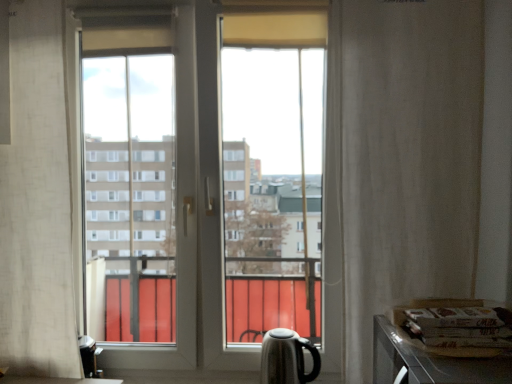
Question: Is white textured curtain at right, the 2th curtain positioned from the left, at the back of transparent glass window at center?

Choices:
 (A) yes
 (B) no

Answer: (B)

Question: Considering the relative sizes of transparent glass window at center and white textured curtain at right, the 2th curtain positioned from the left, in the image provided, is transparent glass window at center thinner than white textured curtain at right, the 2th curtain positioned from the left,?

Choices:
 (A) yes
 (B) no

Answer: (B)

Question: Can you confirm if transparent glass window at center is positioned to the left of white textured curtain at right, the 2th curtain positioned from the left?

Choices:
 (A) no
 (B) yes

Answer: (B)

Question: Considering the relative sizes of transparent glass window at center and white textured curtain at right, the 2th curtain positioned from the left, in the image provided, is transparent glass window at center shorter than white textured curtain at right, the 2th curtain positioned from the left,?

Choices:
 (A) yes
 (B) no

Answer: (B)

Question: Is the depth of transparent glass window at center less than that of white textured curtain at right, which is the first curtain from right to left?

Choices:
 (A) yes
 (B) no

Answer: (B)

Question: From the image's perspective, is transparent glass window at center on top of white textured curtain at right, which is the first curtain from right to left?

Choices:
 (A) no
 (B) yes

Answer: (A)

Question: Does transparent glass window at center appear on the right side of black glossy kettle at lower right?

Choices:
 (A) yes
 (B) no

Answer: (B)

Question: Is transparent glass window at center oriented away from black glossy kettle at lower right?

Choices:
 (A) yes
 (B) no

Answer: (A)

Question: Would you consider transparent glass window at center to be distant from black glossy kettle at lower right?

Choices:
 (A) yes
 (B) no

Answer: (B)

Question: Are transparent glass window at center and black glossy kettle at lower right beside each other?

Choices:
 (A) yes
 (B) no

Answer: (B)

Question: Considering the relative sizes of transparent glass window at center and black glossy kettle at lower right in the image provided, is transparent glass window at center shorter than black glossy kettle at lower right?

Choices:
 (A) yes
 (B) no

Answer: (B)

Question: Does transparent glass window at center have a smaller size compared to black glossy kettle at lower right?

Choices:
 (A) yes
 (B) no

Answer: (B)

Question: Can black glossy kettle at lower right be found inside white textured curtain at right, the 2th curtain positioned from the left?

Choices:
 (A) no
 (B) yes

Answer: (A)